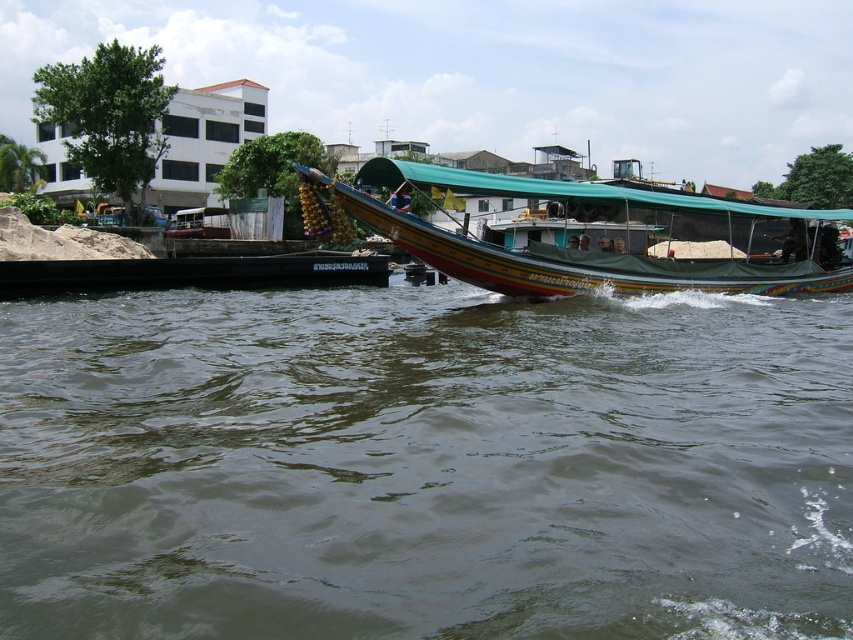
Between brown murky water at center and multicolored painted boat at center, which one has more height?

multicolored painted boat at center

Is brown murky water at center further to the viewer compared to multicolored painted boat at center?

No, brown murky water at center is in front of multicolored painted boat at center.

I want to click on brown murky water at center, so click(x=425, y=465).

Where is `brown murky water at center`? Image resolution: width=853 pixels, height=640 pixels. brown murky water at center is located at coordinates 425,465.